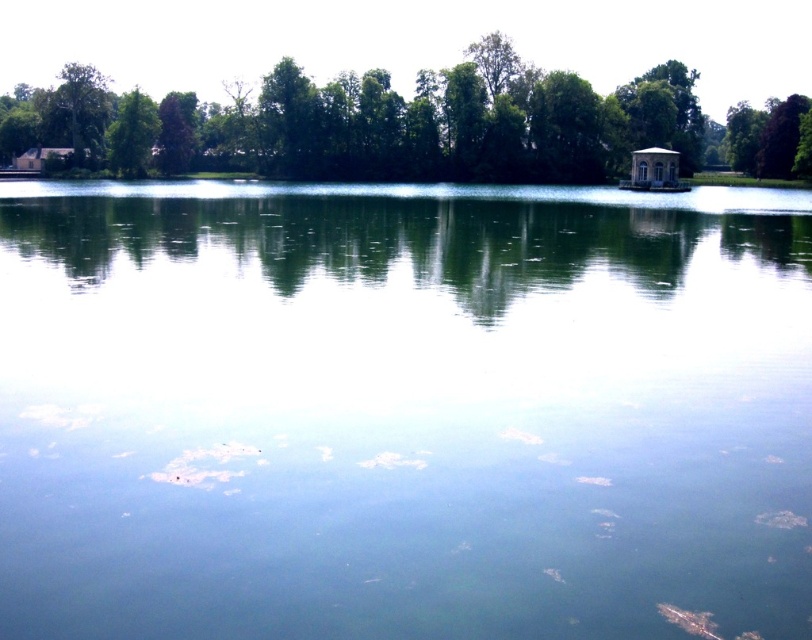
Question: Can you confirm if clear water at center is positioned above green leafy tree at upper center?

Choices:
 (A) no
 (B) yes

Answer: (A)

Question: Does clear water at center appear under green leafy tree at left?

Choices:
 (A) no
 (B) yes

Answer: (B)

Question: Which point is farther to the camera?

Choices:
 (A) green leafy tree at left
 (B) green leafy tree at upper left

Answer: (B)

Question: Can you confirm if green leafy tree at upper center is bigger than green leafy tree at upper left?

Choices:
 (A) yes
 (B) no

Answer: (A)

Question: Which object is closer to the camera taking this photo?

Choices:
 (A) green leafy tree at upper center
 (B) green leafy tree at upper left
 (C) green leafy tree at left
 (D) clear water at center

Answer: (D)

Question: Which object is farther from the camera taking this photo?

Choices:
 (A) green leafy tree at upper left
 (B) green leafy tree at upper center
 (C) clear water at center
 (D) green leafy tree at left

Answer: (A)